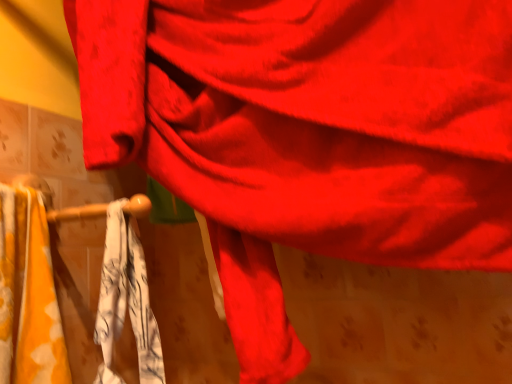
Describe the element at coordinates (28, 294) in the screenshot. This screenshot has width=512, height=384. I see `yellow fabric towel at left` at that location.

You are a GUI agent. You are given a task and a screenshot of the screen. Output one action in this format:
    pyautogui.click(x=<x>, y=<y>)
    Task: Click on the yellow fabric towel at left
    The height and width of the screenshot is (384, 512).
    Given the screenshot: What is the action you would take?
    pyautogui.click(x=28, y=294)

Measure the distance between point (37,193) and camera.

The distance of point (37,193) from camera is 32.68 inches.

At what (x,y) coordinates should I click in order to perform the action: click on yellow fabric towel at left. Please return your answer as a coordinate pair (x, y). The width and height of the screenshot is (512, 384). Looking at the image, I should click on (28, 294).